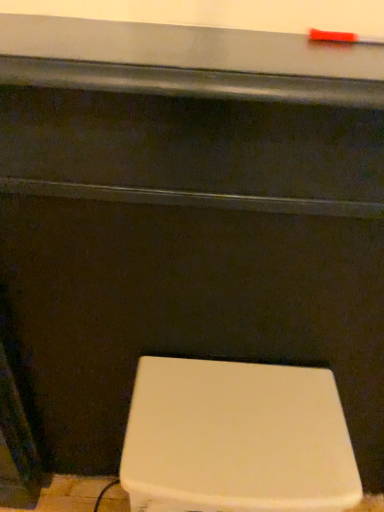
You are a GUI agent. You are given a task and a screenshot of the screen. Output one action in this format:
    pyautogui.click(x=<x>, y=<y>)
    Task: Click on the white matte toilet at lower center
    
    Given the screenshot: What is the action you would take?
    pyautogui.click(x=236, y=439)

What do you see at coordinates (236, 439) in the screenshot?
I see `white matte toilet at lower center` at bounding box center [236, 439].

You are a GUI agent. You are given a task and a screenshot of the screen. Output one action in this format:
    pyautogui.click(x=<x>, y=<y>)
    Task: Click on the white matte toilet at lower center
    The height and width of the screenshot is (512, 384).
    Given the screenshot: What is the action you would take?
    pyautogui.click(x=236, y=439)